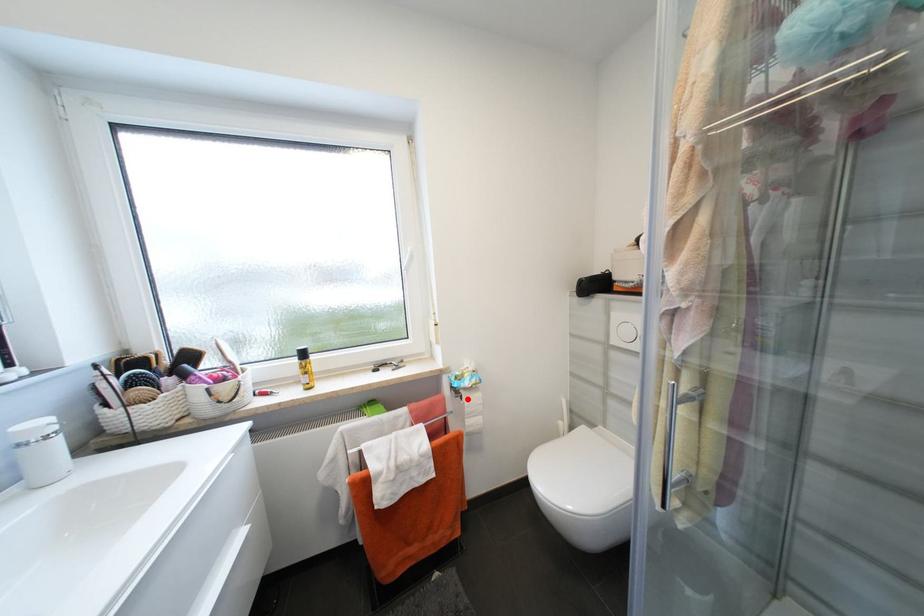
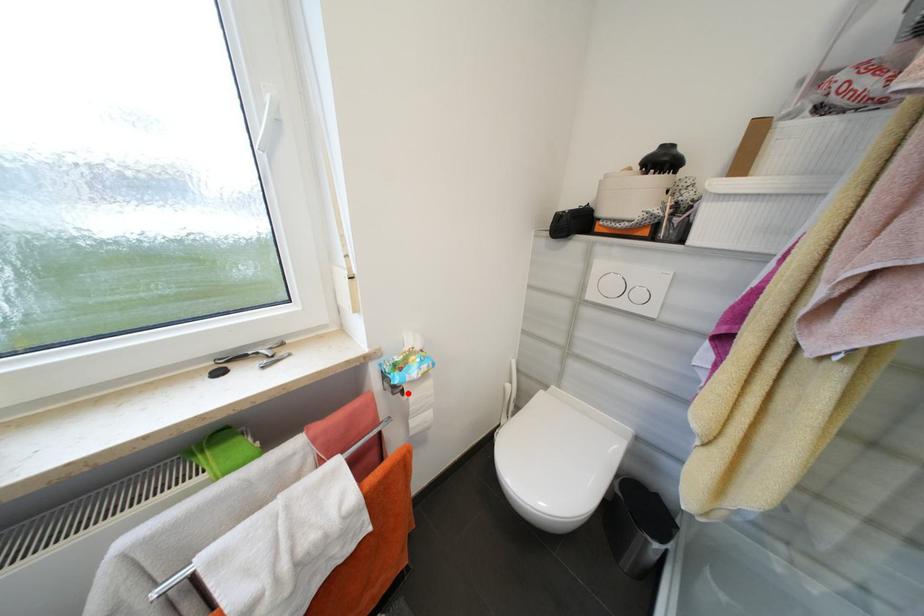
I am providing you with two images of the same scene from different viewpoints. A red point is marked on the first image and another point is marked on the second image. Are the points marked in image1 and image2 representing the same 3D position?

Yes